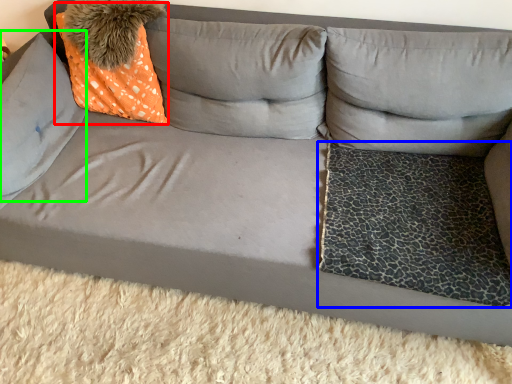
Question: Which object is the farthest from throw pillow (highlighted by a red box)? Choose among these: dog bed (highlighted by a blue box) or pillow (highlighted by a green box).

Choices:
 (A) dog bed
 (B) pillow

Answer: (A)